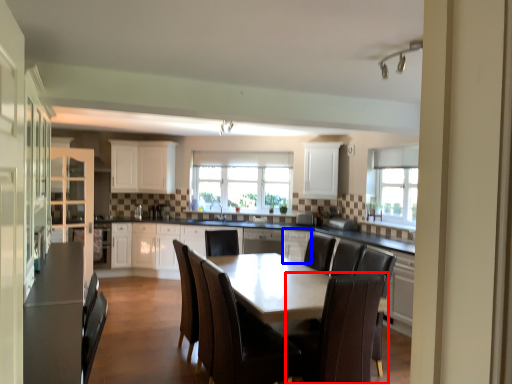
Question: Among these objects, which one is nearest to the camera, chair (highlighted by a red box) or cabinetry (highlighted by a blue box)?

Choices:
 (A) chair
 (B) cabinetry

Answer: (A)